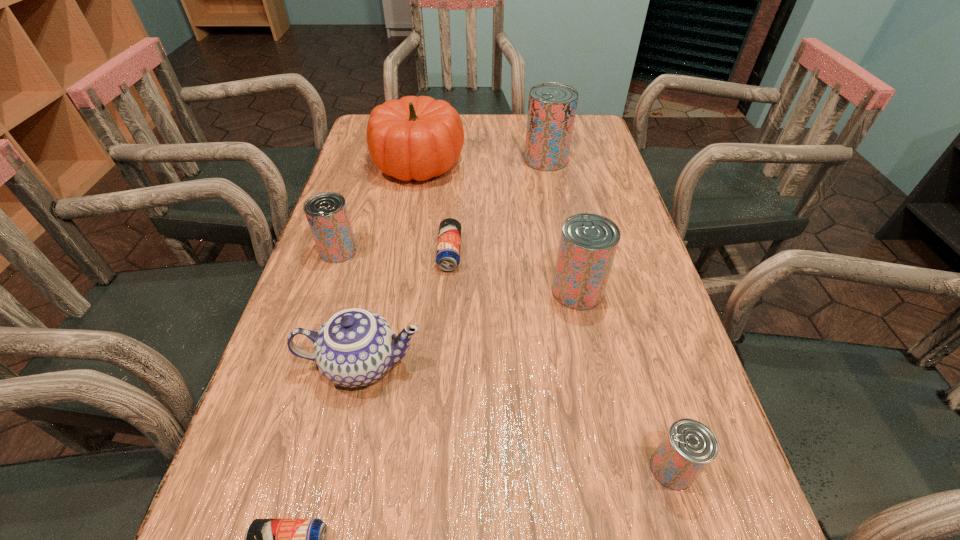
Identify the location of the second nearest beer can. (689, 446).

Image resolution: width=960 pixels, height=540 pixels. Find the location of `the second shortest object`. the second shortest object is located at coordinates (449, 237).

The width and height of the screenshot is (960, 540). I want to click on the bigger blue beer can, so click(449, 237).

Identify the location of free point located on the left of the biggest red beer can. (496, 159).

I want to click on free spot located 0.130m on the front of the pumpkin, so click(408, 222).

In order to click on vacant area located 0.050m on the right of the second biggest red beer can in this screenshot , I will do `click(627, 291)`.

Find the location of a particular element. vacant space located from the spout of the blue chinaware is located at coordinates (643, 364).

This screenshot has width=960, height=540. Find the location of `free region located 0.260m on the front of the fourth shortest beer can`. free region located 0.260m on the front of the fourth shortest beer can is located at coordinates (301, 363).

Find the location of a particular element. This screenshot has width=960, height=540. vacant space located 0.390m on the back of the second nearest beer can is located at coordinates (613, 272).

Where is `vacant space positioned 0.050m on the back of the farther blue beer can`? This screenshot has width=960, height=540. vacant space positioned 0.050m on the back of the farther blue beer can is located at coordinates (452, 221).